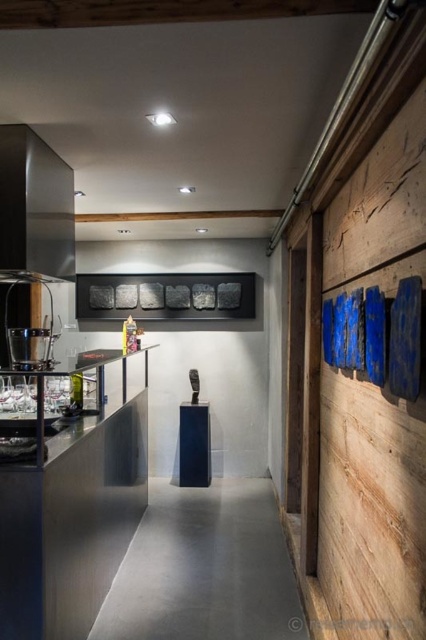
Can you confirm if satin black exhaust hood at upper left is positioned above brushed metal coffee machine at left?

Yes.

This screenshot has width=426, height=640. Describe the element at coordinates (34, 205) in the screenshot. I see `satin black exhaust hood at upper left` at that location.

Does point (9, 182) lie in front of point (19, 349)?

No, (9, 182) is behind (19, 349).

Locate an element on the screen. This screenshot has height=640, width=426. satin black exhaust hood at upper left is located at coordinates point(34,205).

Which is below, stainless steel counter at left or satin black exhaust hood at upper left?

stainless steel counter at left

Who is more distant from viewer, (134, 460) or (37, 150)?

The point (134, 460) is more distant.

Identify the location of stainless steel counter at left. (69, 492).

Who is lower down, stainless steel counter at left or brushed metal coffee machine at left?

Positioned lower is stainless steel counter at left.

Measure the distance between stainless steel counter at left and camera.

A distance of 1.98 meters exists between stainless steel counter at left and camera.

Where is `stainless steel counter at left`? Image resolution: width=426 pixels, height=640 pixels. stainless steel counter at left is located at coordinates pos(69,492).